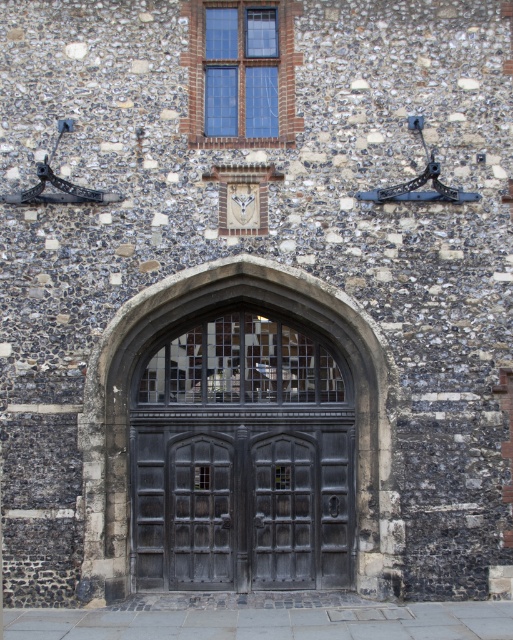
Question: Can you confirm if dark gray stone archway at center is smaller than clear glass window at upper center?

Choices:
 (A) yes
 (B) no

Answer: (B)

Question: Does dark gray stone archway at center have a smaller size compared to clear glass window at upper center?

Choices:
 (A) no
 (B) yes

Answer: (A)

Question: Can you confirm if dark gray stone archway at center is smaller than dark wood door at center?

Choices:
 (A) yes
 (B) no

Answer: (B)

Question: Estimate the real-world distances between objects in this image. Which object is closer to the clear glass window at upper center?

Choices:
 (A) dark gray stone archway at center
 (B) dark wood door at center

Answer: (A)

Question: Among these objects, which one is farthest from the camera?

Choices:
 (A) dark gray stone archway at center
 (B) dark wood door at center

Answer: (B)

Question: Which point is farther to the camera?

Choices:
 (A) dark wood door at center
 (B) dark gray stone archway at center

Answer: (A)